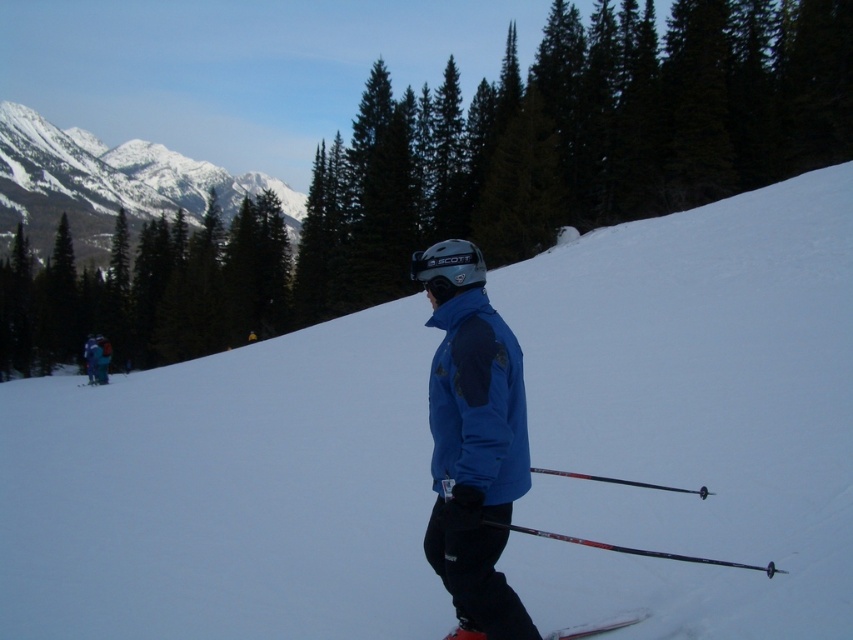
Consider the image. Can you confirm if green matte tree at upper center is thinner than white plastic ski at lower center?

No, green matte tree at upper center is not thinner than white plastic ski at lower center.

Is green matte tree at upper center closer to camera compared to white plastic ski at lower center?

No, green matte tree at upper center is further to the viewer.

Locate an element on the screen. green matte tree at upper center is located at coordinates (576, 138).

At what (x,y) coordinates should I click in order to perform the action: click on green matte tree at upper center. Please return your answer as a coordinate pair (x, y). This screenshot has height=640, width=853. Looking at the image, I should click on (576, 138).

Does point (61, 284) lie in front of point (105, 362)?

That is False.

Who is more distant from viewer, (276, 259) or (102, 358)?

The point (276, 259) is more distant.

Locate an element on the screen. green matte tree at upper left is located at coordinates (148, 291).

Does blue softshell jacket at center appear on the right side of blue fabric jacket at lower left?

Correct, you'll find blue softshell jacket at center to the right of blue fabric jacket at lower left.

Image resolution: width=853 pixels, height=640 pixels. Identify the location of blue softshell jacket at center. (477, 401).

I want to click on blue softshell jacket at center, so click(x=477, y=401).